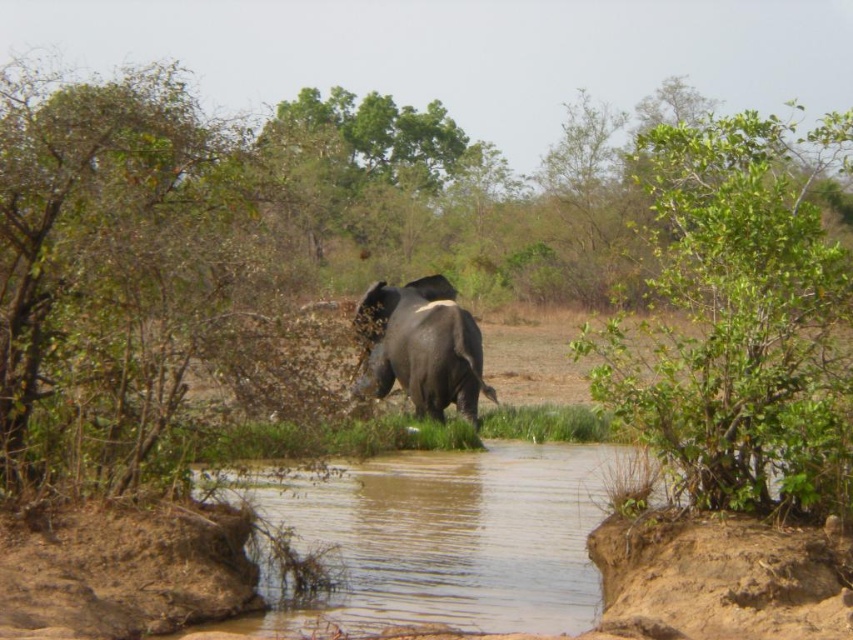
Does brown muddy water at center have a lesser width compared to dark gray elephant at center?

In fact, brown muddy water at center might be wider than dark gray elephant at center.

Describe the element at coordinates (451, 538) in the screenshot. I see `brown muddy water at center` at that location.

Between point (584, 484) and point (430, 355), which one is positioned behind?

Point (430, 355)

Locate an element on the screen. The height and width of the screenshot is (640, 853). brown muddy water at center is located at coordinates (451, 538).